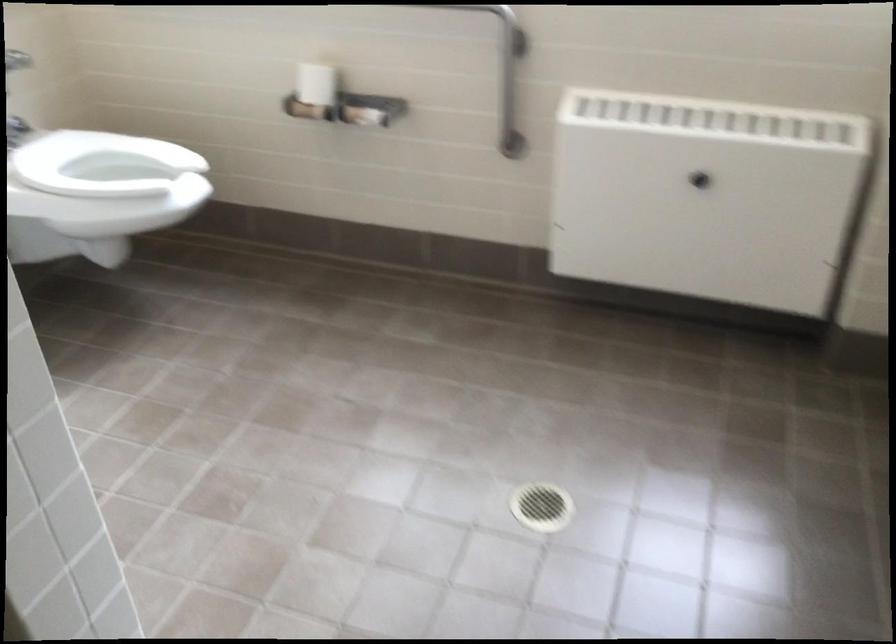
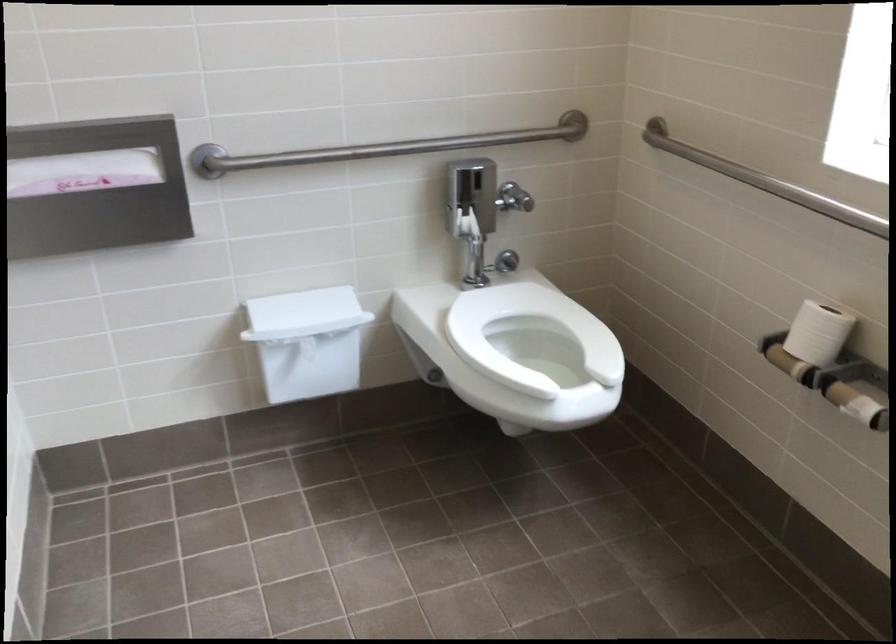
The point at (316, 86) is marked in the first image. Where is the corresponding point in the second image?

(817, 333)